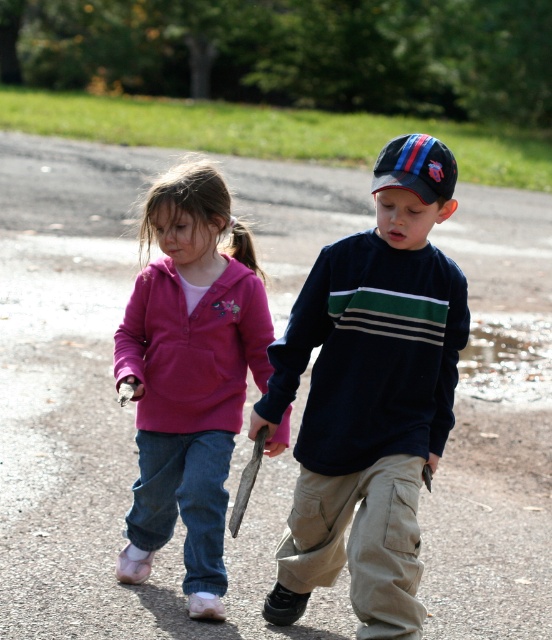
Question: Does dark blue cotton shirt at center have a greater width compared to glistening water at puddle right?

Choices:
 (A) no
 (B) yes

Answer: (A)

Question: Observing the image, what is the correct spatial positioning of dark blue cotton shirt at center in reference to glistening water at puddle right?

Choices:
 (A) left
 (B) right

Answer: (A)

Question: Based on their relative distances, which object is farther from the glistening water at puddle right?

Choices:
 (A) pink fleece jacket at left
 (B) dark blue cotton shirt at center

Answer: (B)

Question: Which object is positioned farthest from the dark blue cotton shirt at center?

Choices:
 (A) pink fleece jacket at left
 (B) glistening water at puddle right

Answer: (B)

Question: Among these objects, which one is nearest to the camera?

Choices:
 (A) pink fleece jacket at left
 (B) dark blue cotton shirt at center
 (C) glistening water at puddle right

Answer: (B)

Question: Does dark blue cotton shirt at center have a larger size compared to pink fleece jacket at left?

Choices:
 (A) yes
 (B) no

Answer: (A)